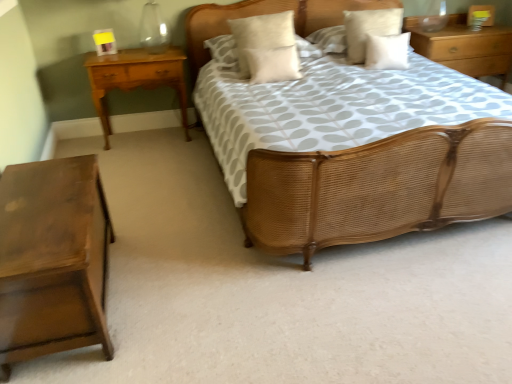
This screenshot has height=384, width=512. What are the coordinates of `blank space situated above light brown wood nightstand at left, arranged as the second nightstand when viewed from the top (from a real-world perspective)` in the screenshot? It's located at coord(134,53).